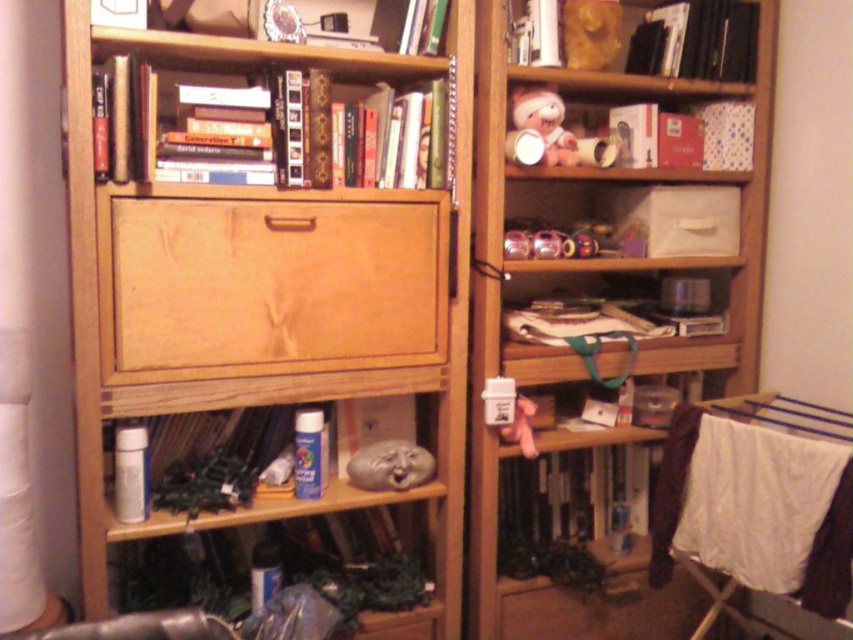
Which is above, hardcover book at center or matte plastic mask at lower center?

matte plastic mask at lower center

Between hardcover book at center and matte plastic mask at lower center, which one is positioned lower?

Positioned lower is hardcover book at center.

The height and width of the screenshot is (640, 853). Find the location of `hardcover book at center`. hardcover book at center is located at coordinates (573, 492).

What do you see at coordinates (177, 92) in the screenshot?
I see `hardcover books at upper center` at bounding box center [177, 92].

Can you confirm if hardcover books at upper center is positioned to the right of gold metallic mask at upper center?

In fact, hardcover books at upper center is to the left of gold metallic mask at upper center.

Find the location of a particular element. This screenshot has width=853, height=640. hardcover books at upper center is located at coordinates (177, 92).

Is black hardcover book at upper right to the right of matte plastic mask at lower center from the viewer's perspective?

Indeed, black hardcover book at upper right is positioned on the right side of matte plastic mask at lower center.

Between black hardcover book at upper right and matte plastic mask at lower center, which one has less height?

matte plastic mask at lower center

Describe the element at coordinates (698, 40) in the screenshot. The width and height of the screenshot is (853, 640). I see `black hardcover book at upper right` at that location.

The width and height of the screenshot is (853, 640). In order to click on black hardcover book at upper right in this screenshot , I will do `click(698, 40)`.